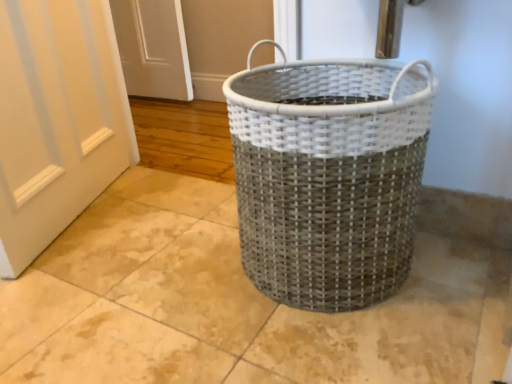
You are a GUI agent. You are given a task and a screenshot of the screen. Output one action in this format:
    pyautogui.click(x=<x>, y=<y>)
    Task: Click on the free space in front of white painted wood door at left
    This screenshot has width=512, height=384.
    Given the screenshot: What is the action you would take?
    pyautogui.click(x=106, y=292)